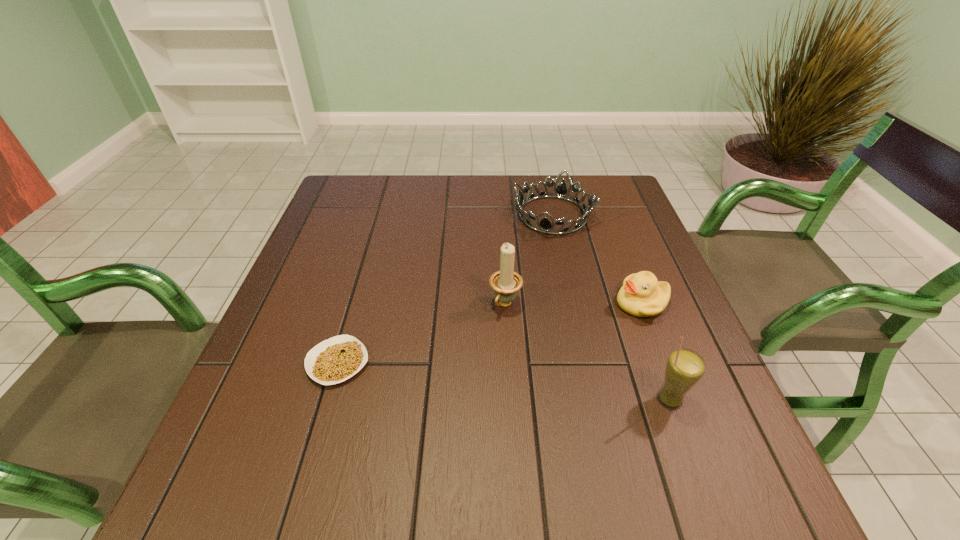
The width and height of the screenshot is (960, 540). Identify the location of blank region between the shortest object and the candle_holder. (421, 334).

Where is `object that stands as the fourth closest to the leftmost object`? object that stands as the fourth closest to the leftmost object is located at coordinates (685, 367).

Point out which object is positioned as the third nearest to the duckling. Please provide its 2D coordinates. Your answer should be formatted as a tuple, i.e. [(x, y)], where the tuple contains the x and y coordinates of a point satisfying the conditions above.

[(505, 282)]

The image size is (960, 540). I want to click on vacant area in the image that satisfies the following two spatial constraints: 1. on the front side of the fourth object from right to left; 2. on the right side of the straw for drinking, so click(511, 399).

Where is `free spot that satisfies the following two spatial constraints: 1. on the front side of the straw for drinking; 2. on the left side of the candle_holder`? The image size is (960, 540). free spot that satisfies the following two spatial constraints: 1. on the front side of the straw for drinking; 2. on the left side of the candle_holder is located at coordinates (511, 399).

I want to click on vacant position in the image that satisfies the following two spatial constraints: 1. on the back side of the leftmost object; 2. on the left side of the duckling, so click(355, 303).